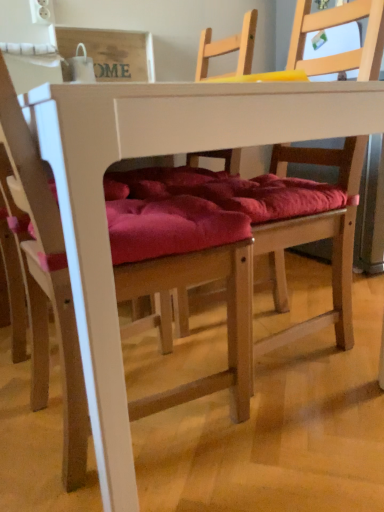
Question: Can you confirm if white matte table at center is bigger than velvet red cushion at center, which is the 2th chair in right-to-left order?

Choices:
 (A) yes
 (B) no

Answer: (A)

Question: From the image's perspective, would you say white matte table at center is positioned over velvet red cushion at center, positioned as the 1th chair in left-to-right order?

Choices:
 (A) yes
 (B) no

Answer: (A)

Question: Is white matte table at center turned away from velvet red cushion at center, which is the 2th chair in right-to-left order?

Choices:
 (A) yes
 (B) no

Answer: (A)

Question: Is white matte table at center located outside velvet red cushion at center, which is the 2th chair in right-to-left order?

Choices:
 (A) no
 (B) yes

Answer: (B)

Question: From a real-world perspective, is white matte table at center positioned under velvet red cushion at center, which is the 2th chair in right-to-left order, based on gravity?

Choices:
 (A) yes
 (B) no

Answer: (A)

Question: Can you confirm if white matte table at center is wider than velvet red cushion at center, which is the 2th chair in right-to-left order?

Choices:
 (A) yes
 (B) no

Answer: (A)

Question: From the image's perspective, is wooden chair with red cushion at center, acting as the second chair starting from the left, beneath white matte table at center?

Choices:
 (A) yes
 (B) no

Answer: (B)

Question: Is wooden chair with red cushion at center, which is counted as the first chair, starting from the right, bigger than white matte table at center?

Choices:
 (A) no
 (B) yes

Answer: (A)

Question: From a real-world perspective, is wooden chair with red cushion at center, which is counted as the first chair, starting from the right, positioned over white matte table at center based on gravity?

Choices:
 (A) yes
 (B) no

Answer: (A)

Question: Is wooden chair with red cushion at center, acting as the second chair starting from the left, next to white matte table at center and touching it?

Choices:
 (A) yes
 (B) no

Answer: (B)

Question: Is wooden chair with red cushion at center, acting as the second chair starting from the left, closer to camera compared to white matte table at center?

Choices:
 (A) yes
 (B) no

Answer: (B)

Question: Can you confirm if wooden chair with red cushion at center, acting as the second chair starting from the left, is positioned to the right of white matte table at center?

Choices:
 (A) yes
 (B) no

Answer: (A)

Question: Is white matte table at center oriented towards wooden chair with red cushion at center, which is counted as the first chair, starting from the right?

Choices:
 (A) yes
 (B) no

Answer: (A)